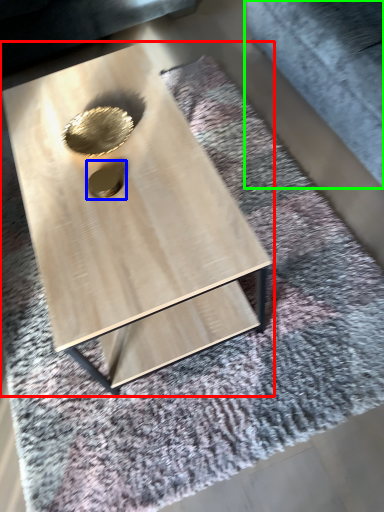
Question: Based on their relative distances, which object is farther from coffee table (highlighted by a red box)? Choose from hole (highlighted by a blue box) and gray (highlighted by a green box).

Choices:
 (A) hole
 (B) gray

Answer: (B)